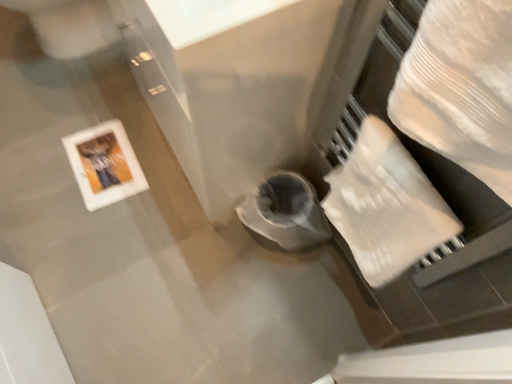
This screenshot has width=512, height=384. In order to click on free spot behind white glossy picture frame at upper left in this screenshot , I will do `click(106, 107)`.